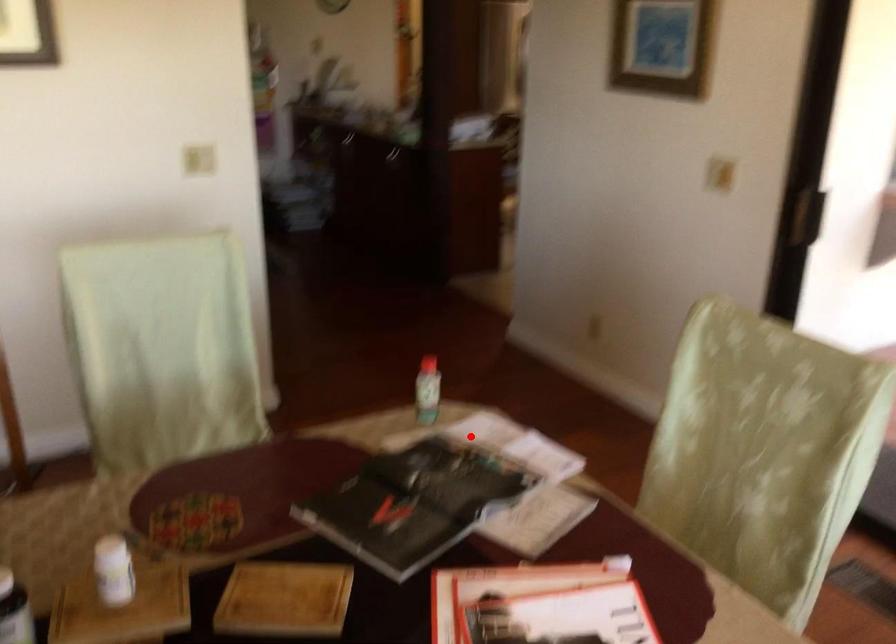
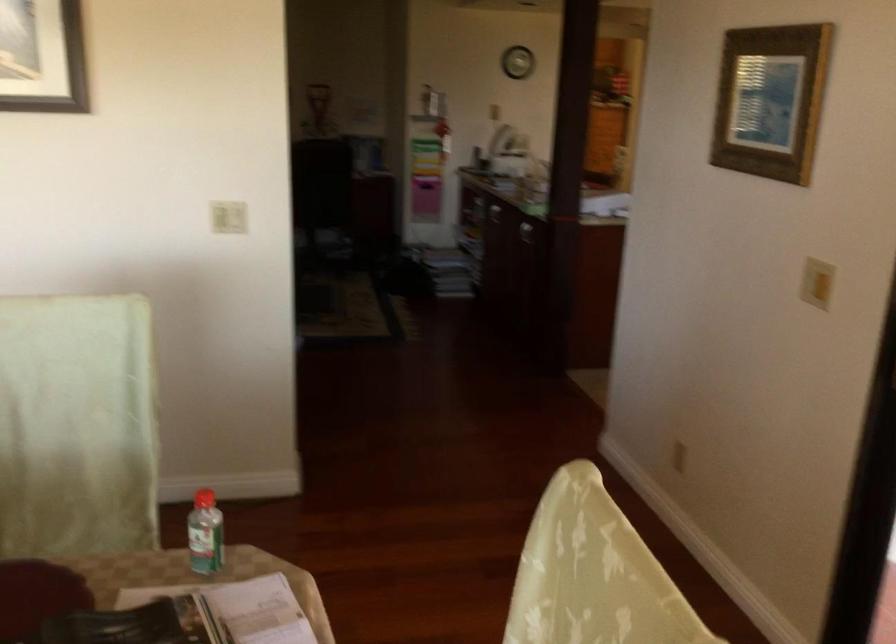
Question: I am providing you with two images of the same scene from different viewpoints. A red point is marked on the first image. At the location where the point appears in image 1, is it still visible in image 2?

Choices:
 (A) Yes
 (B) No

Answer: (A)